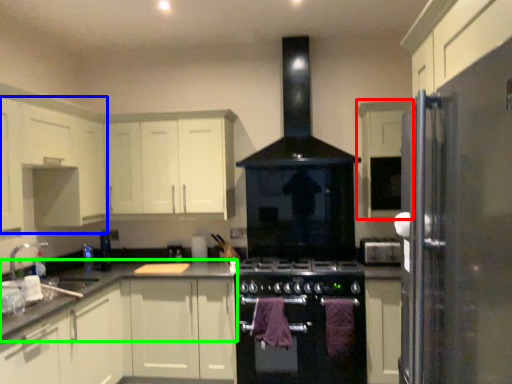
Question: Estimate the real-world distances between objects in this image. Which object is closer to cabinetry (highlighted by a red box), cabinetry (highlighted by a blue box) or countertop (highlighted by a green box)?

Choices:
 (A) cabinetry
 (B) countertop

Answer: (B)